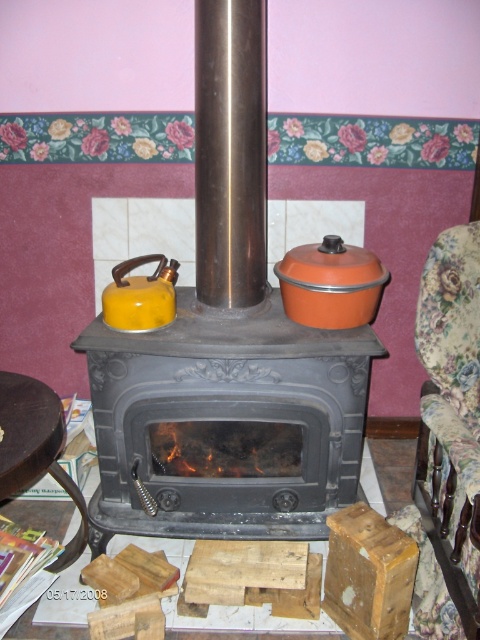
Question: Which point is farther from the camera taking this photo?

Choices:
 (A) click(x=146, y=499)
 (B) click(x=336, y=460)
 (C) click(x=160, y=314)
 (D) click(x=418, y=532)

Answer: (B)

Question: Which object is closer to the camera taking this photo?

Choices:
 (A) matte black stove at center
 (B) floral fabric armchair at right

Answer: (B)

Question: Does matte black fireplace at center come in front of floral fabric armchair at right?

Choices:
 (A) yes
 (B) no

Answer: (B)

Question: Among these points, which one is farthest from the camera?

Choices:
 (A) (178, 337)
 (B) (108, 388)
 (C) (460, 305)
 (D) (159, 291)

Answer: (B)

Question: Does floral fabric armchair at right appear on the right side of yellow matte tea pot at center?

Choices:
 (A) no
 (B) yes

Answer: (B)

Question: Does matte black fireplace at center appear over floral fabric armchair at right?

Choices:
 (A) no
 (B) yes

Answer: (B)